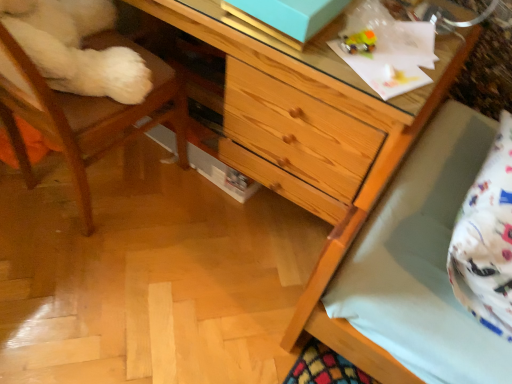
This screenshot has height=384, width=512. Identify the location of vacant space situated on the left part of translucent plastic toy at upper right. (304, 48).